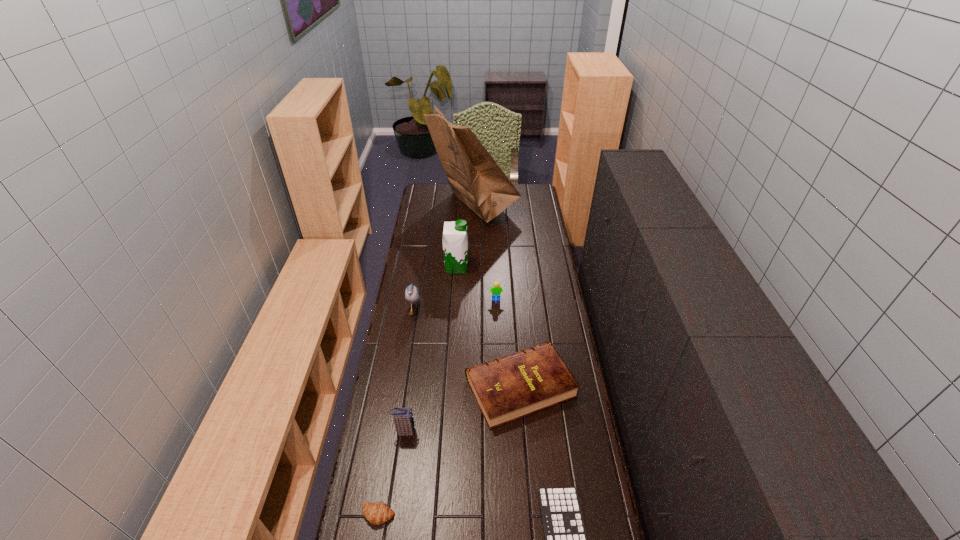
This screenshot has height=540, width=960. In order to click on empty space between the Lego and the crescent roll in this screenshot , I will do `click(437, 407)`.

Image resolution: width=960 pixels, height=540 pixels. Identify the location of free space that is in between the Lego and the sixth shortest object. (455, 306).

Where is `unoccupied area between the grocery bag and the seventh tallest object`? The height and width of the screenshot is (540, 960). unoccupied area between the grocery bag and the seventh tallest object is located at coordinates (426, 360).

The width and height of the screenshot is (960, 540). Find the location of `free point between the third tallest object and the second farthest object`. free point between the third tallest object and the second farthest object is located at coordinates (435, 289).

Where is `empty location between the third tallest object and the hardback book`? This screenshot has width=960, height=540. empty location between the third tallest object and the hardback book is located at coordinates (468, 349).

You are a GUI agent. You are given a task and a screenshot of the screen. Output one action in this format:
    pyautogui.click(x=<x>, y=<y>)
    Task: Click on the empty space that is in between the fifth tallest object and the tallest object
    The width and height of the screenshot is (960, 540).
    Given the screenshot: What is the action you would take?
    pyautogui.click(x=485, y=253)

The width and height of the screenshot is (960, 540). I want to click on vacant area between the seventh nearest object and the third tallest object, so click(x=435, y=289).

Identify which object is the seventh nearest to the fourth shortest object. Please provide its 2D coordinates. Your answer should be formatted as a tuple, i.e. [(x, y)], where the tuple contains the x and y coordinates of a point satisfying the conditions above.

[(377, 513)]

Where is `object that is the sixth closest to the Lego`? The image size is (960, 540). object that is the sixth closest to the Lego is located at coordinates (565, 537).

This screenshot has height=540, width=960. I want to click on vacant region that satisfies the following two spatial constraints: 1. at the tip of the hardback book's beak; 2. on the left side of the third tallest object, so click(402, 387).